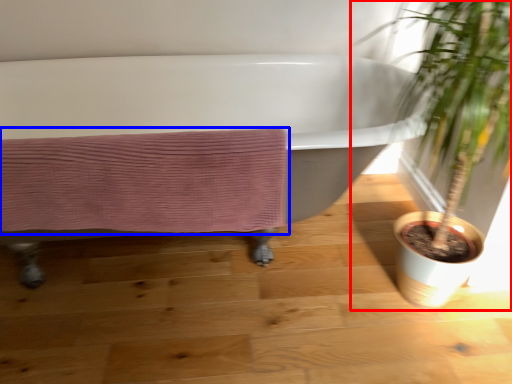
Question: Which object is closer to the camera taking this photo, houseplant (highlighted by a red box) or bath towel (highlighted by a blue box)?

Choices:
 (A) houseplant
 (B) bath towel

Answer: (A)